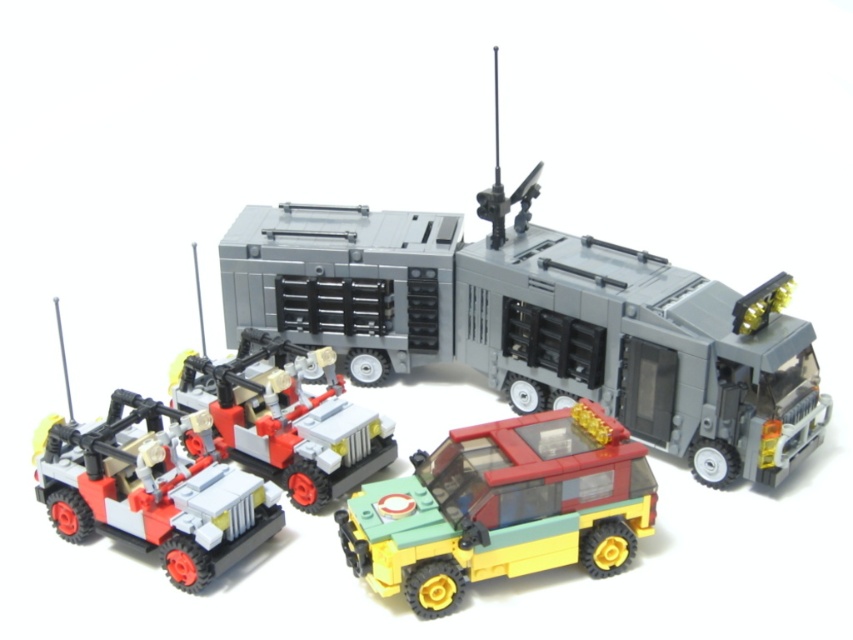
You are a toy collector examining the LEGO vehicles arranged on a table. You notice the yellow matte car at lower center. Can you determine its exact position relative to the other vehicles in the scene?

The yellow matte car at lower center is located at point (x=502, y=508), which places it centrally in the lower portion of the scene.